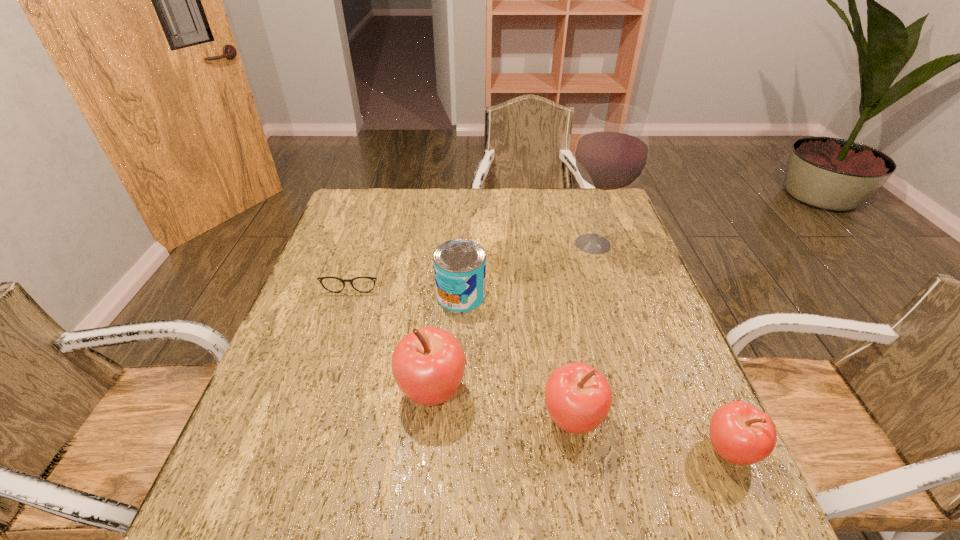
At what (x,y) coordinates should I click in order to perform the action: click on vacant area that satisfies the following two spatial constraints: 1. on the front side of the second tallest apple; 2. on the right side of the leftmost apple. Please return your answer as a coordinate pair (x, y). This screenshot has width=960, height=540. Looking at the image, I should click on (429, 419).